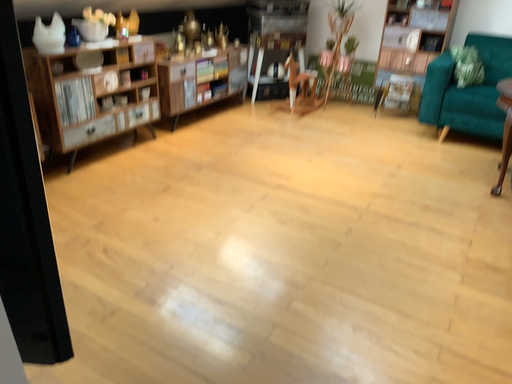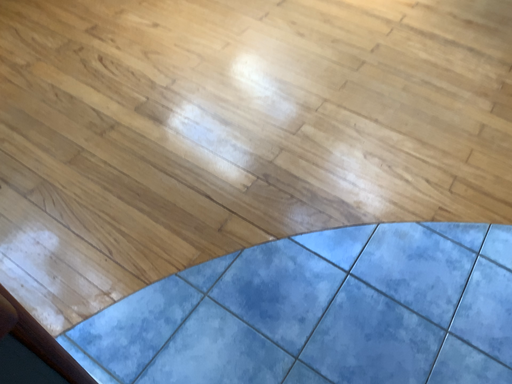
Question: How did the camera likely rotate when shooting the video?

Choices:
 (A) rotated upward
 (B) rotated downward

Answer: (B)